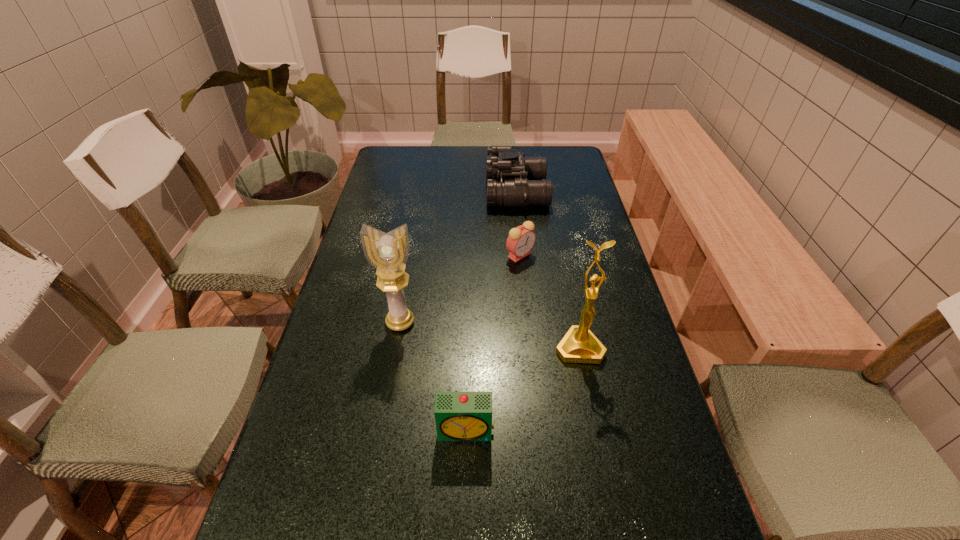
At what (x,y) coordinates should I click in order to perform the action: click on free space at the left edge of the desktop. Please return your answer as a coordinate pair (x, y). Looking at the image, I should click on (357, 323).

Locate an element on the screen. vacant space at the right edge of the desktop is located at coordinates (592, 249).

This screenshot has width=960, height=540. In the image, there is a desktop. What are the coordinates of `vacant space at the far right corner` in the screenshot? It's located at (539, 147).

This screenshot has height=540, width=960. What are the coordinates of `vacant space that's between the right alarm clock and the third tallest object` in the screenshot? It's located at (518, 224).

At what (x,y) coordinates should I click in order to perform the action: click on free spot between the farthest object and the left award. Please return your answer as a coordinate pair (x, y). The height and width of the screenshot is (540, 960). Looking at the image, I should click on (459, 257).

What are the coordinates of `vacant area that lies between the left award and the nearer alarm clock` in the screenshot? It's located at (433, 377).

Where is `vacant area that lies between the third shortest object and the left award`? vacant area that lies between the third shortest object and the left award is located at coordinates (459, 257).

Find the location of `free point between the right award and the left award`. free point between the right award and the left award is located at coordinates (490, 335).

Identify the location of empty space that is in between the third tallest object and the right award. The height and width of the screenshot is (540, 960). (548, 269).

Image resolution: width=960 pixels, height=540 pixels. Find the location of `unoccupied position between the left award and the binoculars`. unoccupied position between the left award and the binoculars is located at coordinates 459,257.